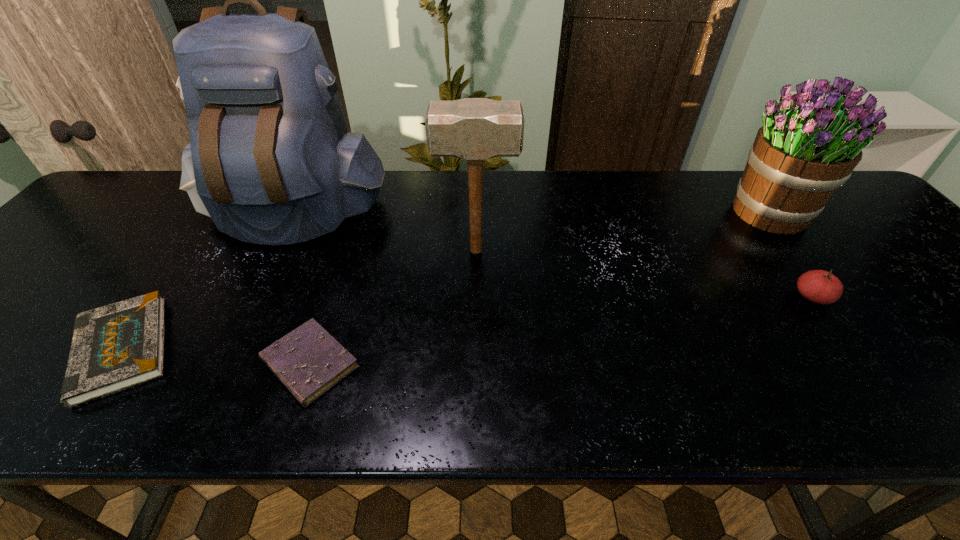
I want to click on free space at the right edge of the desktop, so click(x=889, y=262).

This screenshot has height=540, width=960. What are the coordinates of `empty space that is in between the bouquet and the mallet` in the screenshot? It's located at (622, 232).

What are the coordinates of `empty location between the diary and the bouquet` in the screenshot? It's located at (540, 288).

The image size is (960, 540). I want to click on empty space that is in between the diary and the bouquet, so click(540, 288).

You are a GUI agent. You are given a task and a screenshot of the screen. Output one action in this format:
    pyautogui.click(x=<x>, y=<y>)
    Task: Click on the free point between the second shortest object and the shortest object
    Image resolution: width=960 pixels, height=540 pixels.
    Given the screenshot: What is the action you would take?
    pyautogui.click(x=216, y=356)

This screenshot has height=540, width=960. I want to click on empty location between the backpack and the third object from right to left, so click(x=384, y=232).

Identify the location of free point between the diary and the mallet. (393, 307).

The height and width of the screenshot is (540, 960). In order to click on empty space that is in between the shortest object and the notebook in this screenshot , I will do `click(216, 356)`.

Identify the location of free space between the tomato and the shortest object. The width and height of the screenshot is (960, 540). point(561,330).

This screenshot has height=540, width=960. Find the location of `free space between the bouquet and the second shortest object`. free space between the bouquet and the second shortest object is located at coordinates (445, 281).